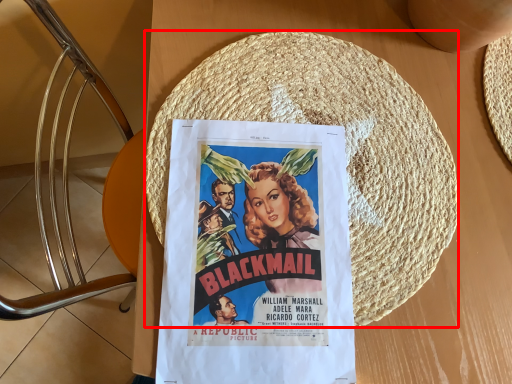
Question: From the image's perspective, considering the relative positions of straw hat (annotated by the red box) and poster in the image provided, where is straw hat (annotated by the red box) located with respect to the staircase?

Choices:
 (A) above
 (B) below

Answer: (A)